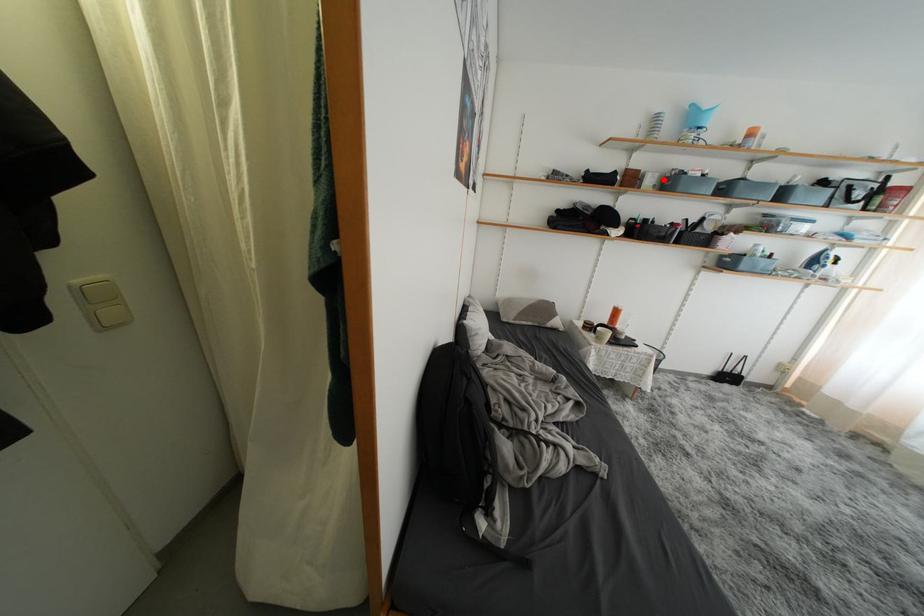
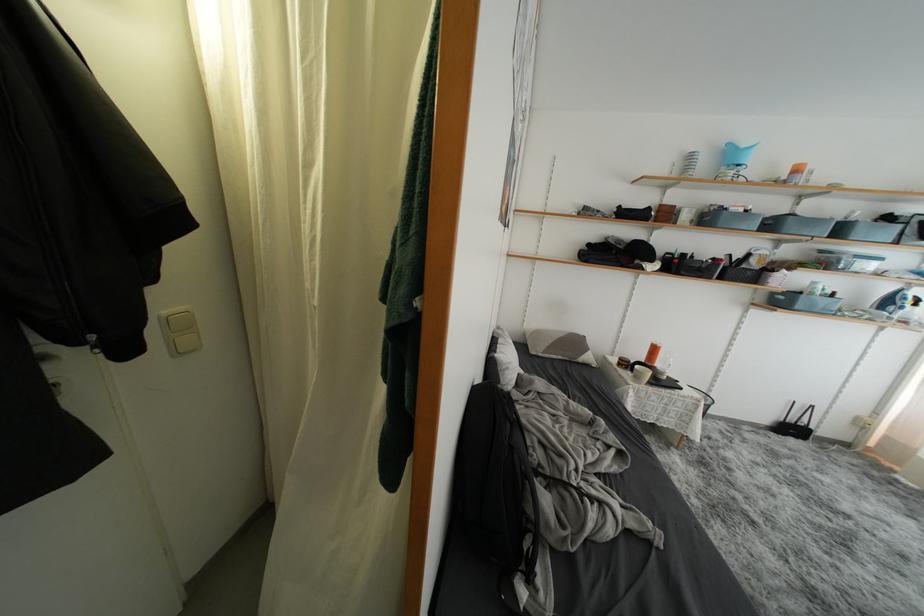
Find the pixel in the second image that matches the highlighted location in the first image.

(700, 215)